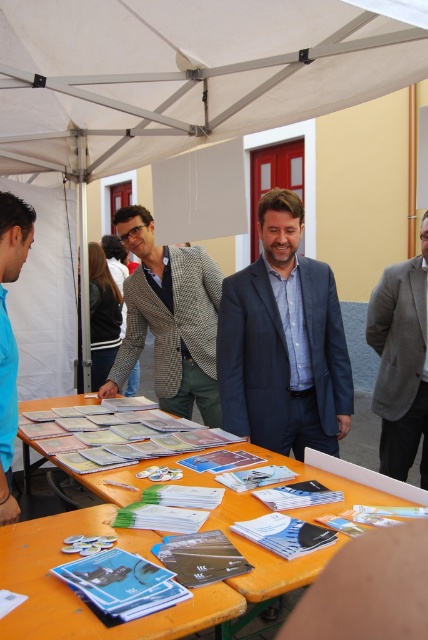
The width and height of the screenshot is (428, 640). What are the coordinates of `beige fabric canopy at upper center` in the screenshot? It's located at (183, 74).

You are a GUI agent. You are given a task and a screenshot of the screen. Output one action in this format:
    pyautogui.click(x=<x>, y=<y>)
    Task: Click on the beige fabric canopy at upper center
    Image resolution: width=428 pixels, height=640 pixels.
    Given the screenshot: What is the action you would take?
    pyautogui.click(x=183, y=74)

Between point (244, 371) and point (142, 636), which one is positioned behind?

Positioned behind is point (244, 371).

Looking at this image, which is above, blue fabric suit at center or orange paper at lower center?

blue fabric suit at center is above.

Is point (309, 404) farther from viewer compared to point (12, 618)?

Yes, it is.

I want to click on blue fabric suit at center, so click(x=284, y=342).

Who is higher up, orange paper at lower center or matte houndstooth blazer at center?

matte houndstooth blazer at center is higher up.

Does point (85, 528) lie behind point (190, 266)?

That is False.

Find the location of a particular element. orange paper at lower center is located at coordinates click(x=79, y=600).